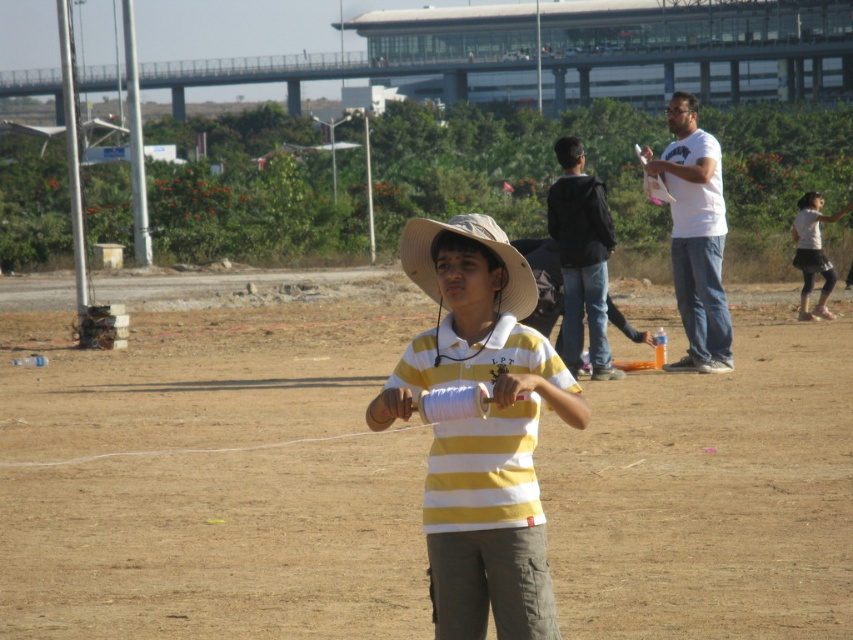
What do you see at coordinates (212, 477) in the screenshot?
I see `brown dirt field at center` at bounding box center [212, 477].

Is brown dirt field at center in front of tan straw hat at center?

That is False.

Is point (144, 353) positioned behind point (415, 243)?

Yes, it is behind point (415, 243).

This screenshot has height=640, width=853. What are the coordinates of `brown dirt field at center` in the screenshot? It's located at (212, 477).

Which of these two, black matte jacket at upper right or white cotton shirt at right, stands taller?

black matte jacket at upper right

Does black matte jacket at upper right appear on the left side of white cotton shirt at right?

Correct, you'll find black matte jacket at upper right to the left of white cotton shirt at right.

Does point (581, 196) lie behind point (828, 221)?

No, it is in front of (828, 221).

At what (x,y) coordinates should I click in order to perform the action: click on black matte jacket at upper right. Please return your answer as a coordinate pair (x, y). Looking at the image, I should click on (581, 259).

Is point (422, 237) closer to viewer compared to point (807, 257)?

Yes.

Which is behind, point (428, 218) or point (799, 296)?

Point (428, 218)

Between point (407, 252) and point (837, 218), which one is positioned behind?

The point (837, 218) is behind.

Identify the location of tan straw hat at center. The height and width of the screenshot is (640, 853). (477, 241).